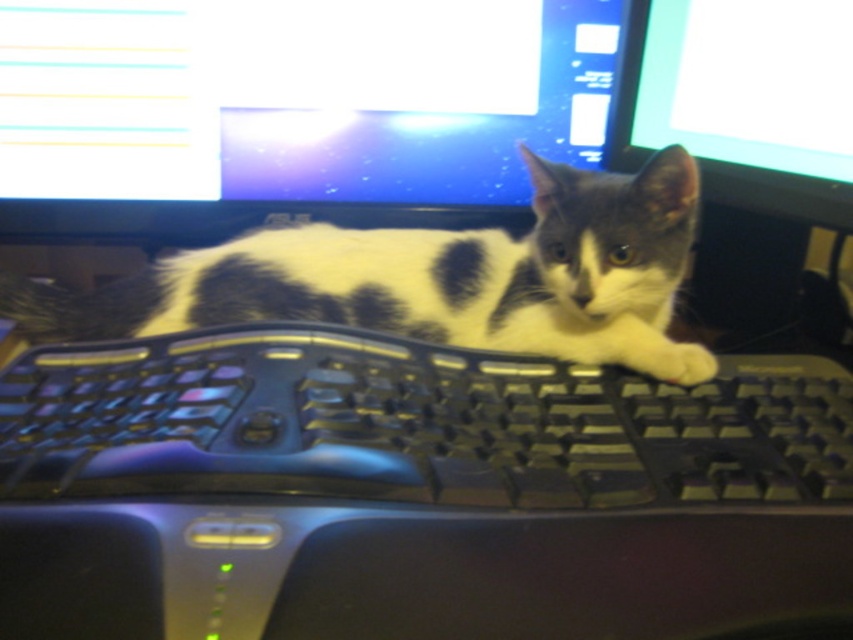
Question: Does matte black monitor at upper center come in front of white-furred cat at center?

Choices:
 (A) yes
 (B) no

Answer: (B)

Question: Estimate the real-world distances between objects in this image. Which object is farther from the black plastic keyboard at center?

Choices:
 (A) matte black monitor at upper center
 (B) white-furred cat at center

Answer: (A)

Question: Which object is closer to the camera taking this photo?

Choices:
 (A) matte black monitor at upper right
 (B) white-furred cat at center
 (C) matte black monitor at upper center
 (D) black plastic keyboard at center

Answer: (D)

Question: Can you confirm if black plastic keyboard at center is positioned to the right of matte black monitor at upper center?

Choices:
 (A) no
 (B) yes

Answer: (B)

Question: In this image, where is black plastic keyboard at center located relative to matte black monitor at upper right?

Choices:
 (A) left
 (B) right

Answer: (A)

Question: Which object is farther from the camera taking this photo?

Choices:
 (A) matte black monitor at upper center
 (B) white-furred cat at center
 (C) matte black monitor at upper right
 (D) black plastic keyboard at center

Answer: (A)